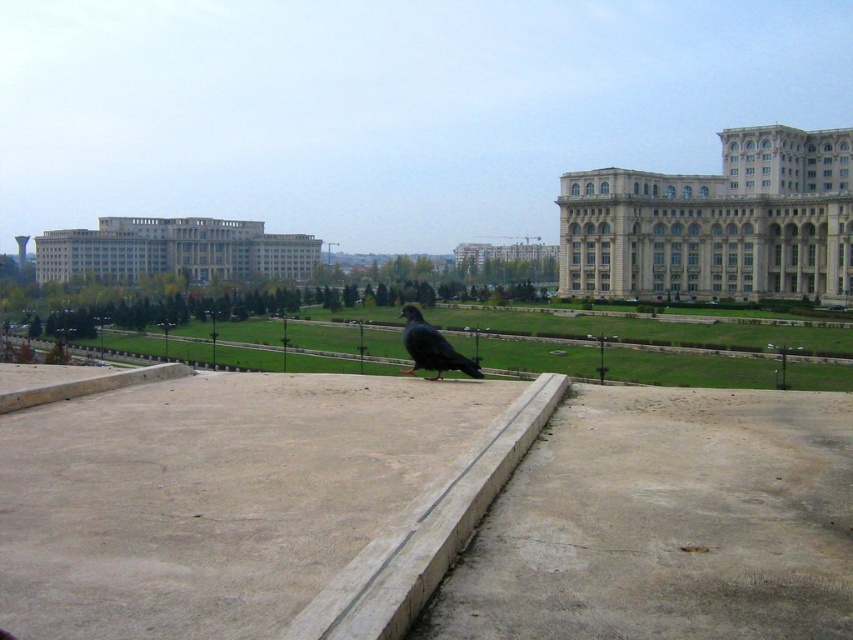
Does white stone building at upper right have a larger size compared to matte gray building at center?

Indeed, white stone building at upper right has a larger size compared to matte gray building at center.

Based on the photo, can you confirm if white stone building at upper right is positioned to the right of matte gray building at center?

Correct, you'll find white stone building at upper right to the right of matte gray building at center.

In the scene shown: Who is more forward, (723, 243) or (500, 252)?

Positioned in front is point (723, 243).

Identify the location of white stone building at upper right. (717, 224).

Can you confirm if brown concrete at center is thinner than gray stone building at center?

Yes.

Does brown concrete at center have a greater width compared to gray stone building at center?

No.

Locate an element on the screen. The width and height of the screenshot is (853, 640). brown concrete at center is located at coordinates (665, 524).

The height and width of the screenshot is (640, 853). What do you see at coordinates (717, 224) in the screenshot?
I see `white stone building at upper right` at bounding box center [717, 224].

Who is taller, white stone building at upper right or shiny black bird at center?

With more height is white stone building at upper right.

Find the location of `white stone building at upper right`. white stone building at upper right is located at coordinates (717, 224).

Identify the location of white stone building at upper right. (717, 224).